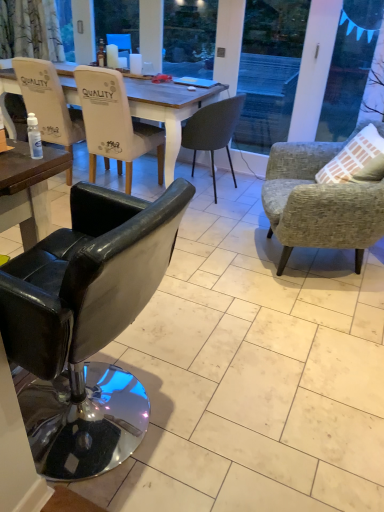
Question: Is transparent plastic bottle at lower left smaller than white glossy coffee cup at upper center?

Choices:
 (A) yes
 (B) no

Answer: (A)

Question: Can you confirm if transparent plastic bottle at lower left is positioned to the right of white glossy coffee cup at upper center?

Choices:
 (A) no
 (B) yes

Answer: (A)

Question: Does transparent plastic bottle at lower left have a greater width compared to white glossy coffee cup at upper center?

Choices:
 (A) yes
 (B) no

Answer: (B)

Question: Is transparent plastic bottle at lower left thinner than white glossy coffee cup at upper center?

Choices:
 (A) no
 (B) yes

Answer: (B)

Question: From the image's perspective, does transparent plastic bottle at lower left appear higher than white glossy coffee cup at upper center?

Choices:
 (A) yes
 (B) no

Answer: (B)

Question: Would you say white glossy coffee cup at upper center is to the left or to the right of white leather chair at upper left, which is the 2th chair from left to right, in the picture?

Choices:
 (A) left
 (B) right

Answer: (B)

Question: From a real-world perspective, is white glossy coffee cup at upper center positioned above or below white leather chair at upper left, which is the 2th chair from left to right?

Choices:
 (A) above
 (B) below

Answer: (A)

Question: Does point (137, 61) appear closer or farther from the camera than point (104, 84)?

Choices:
 (A) closer
 (B) farther

Answer: (B)

Question: From the image's perspective, is white glossy coffee cup at upper center located above or below white leather chair at upper left, the fourth chair from the right?

Choices:
 (A) below
 (B) above

Answer: (B)

Question: Looking at their shapes, would you say black leather chair at left, which ranks as the third chair in left-to-right order, is wider or thinner than textured gray armchair at right, which is the first chair from right to left?

Choices:
 (A) wide
 (B) thin

Answer: (B)

Question: Is black leather chair at left, arranged as the third chair when viewed from the right, to the left or to the right of textured gray armchair at right, which is the first chair from right to left, in the image?

Choices:
 (A) left
 (B) right

Answer: (A)

Question: Would you say black leather chair at left, arranged as the third chair when viewed from the right, is inside or outside textured gray armchair at right, which is the fifth chair in left-to-right order?

Choices:
 (A) outside
 (B) inside

Answer: (A)

Question: Does point (87, 258) appear closer or farther from the camera than point (327, 142)?

Choices:
 (A) closer
 (B) farther

Answer: (A)

Question: From the image's perspective, is black leather chair at left, arranged as the third chair when viewed from the right, above or below white glossy coffee cup at upper center?

Choices:
 (A) above
 (B) below

Answer: (B)

Question: In terms of height, does black leather chair at left, arranged as the third chair when viewed from the right, look taller or shorter compared to white glossy coffee cup at upper center?

Choices:
 (A) short
 (B) tall

Answer: (B)